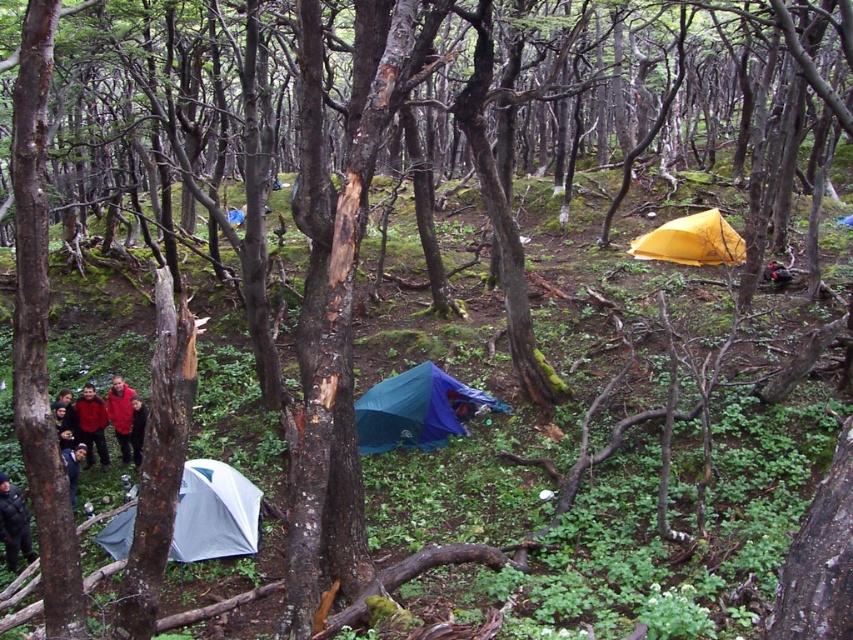
Question: Among these objects, which one is nearest to the camera?

Choices:
 (A) blue tarpaulin tent at center
 (B) yellow matte tent at upper right
 (C) dark blue jeans at lower left

Answer: (C)

Question: Based on their relative distances, which object is nearer to the dark gray uniform at lower left?

Choices:
 (A) white fabric tent at lower left
 (B) red jacket at left
 (C) red wool sweater at lower left
 (D) yellow matte tent at upper right

Answer: (A)

Question: Is white fabric tent at lower left to the right of red jacket at left from the viewer's perspective?

Choices:
 (A) no
 (B) yes

Answer: (B)

Question: Which object is closer to the camera taking this photo?

Choices:
 (A) dark red jacket at lower left
 (B) white fabric tent at lower left

Answer: (B)

Question: Can you confirm if red fleece jacket at lower left is thinner than dark blue jeans at lower left?

Choices:
 (A) no
 (B) yes

Answer: (A)

Question: Is red wool sweater at lower left to the left of red fleece jacket at lower left from the viewer's perspective?

Choices:
 (A) yes
 (B) no

Answer: (A)